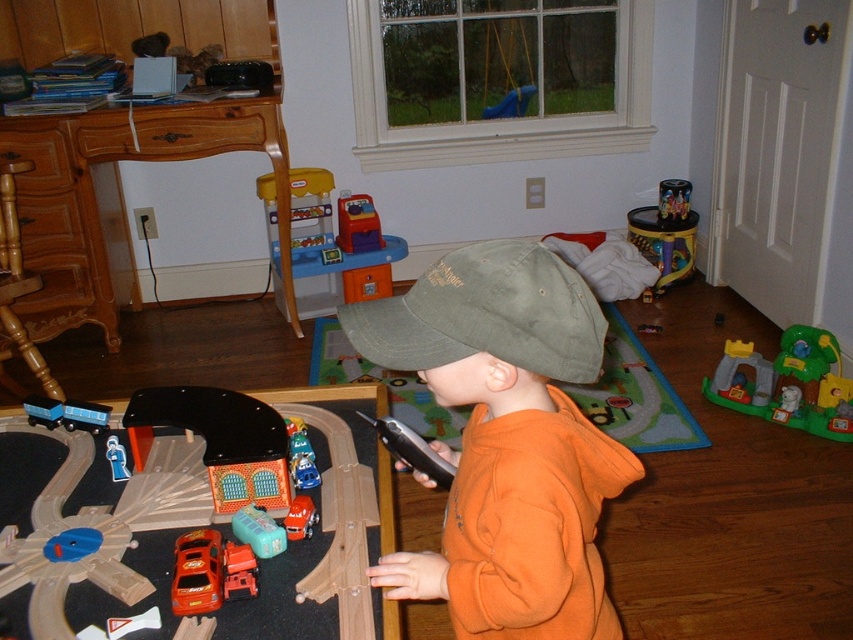
Between green plastic playset at lower right and matte plastic train car at left, which one appears on the left side from the viewer's perspective?

matte plastic train car at left is more to the left.

I want to click on green plastic playset at lower right, so click(x=787, y=384).

Is point (531, 323) positioned after point (293, 524)?

No, (531, 323) is in front of (293, 524).

Between olive green fabric baseball cap at center and smooth plastic car at center, which one has more height?

olive green fabric baseball cap at center

Who is more forward, [415,340] or [299,538]?

Point [415,340] is in front.

The image size is (853, 640). In order to click on olive green fabric baseball cap at center in this screenshot , I will do `click(486, 314)`.

Based on the photo, does orange fleece sweatshirt at center have a larger size compared to black plastic train at left?

Indeed, orange fleece sweatshirt at center has a larger size compared to black plastic train at left.

Who is higher up, orange fleece sweatshirt at center or black plastic train at left?

orange fleece sweatshirt at center is higher up.

Is point (602, 588) less distant than point (210, 480)?

Yes, it is in front of point (210, 480).

At what (x,y) coordinates should I click in order to perform the action: click on orange fleece sweatshirt at center. Please return your answer as a coordinate pair (x, y). The width and height of the screenshot is (853, 640). Looking at the image, I should click on (506, 440).